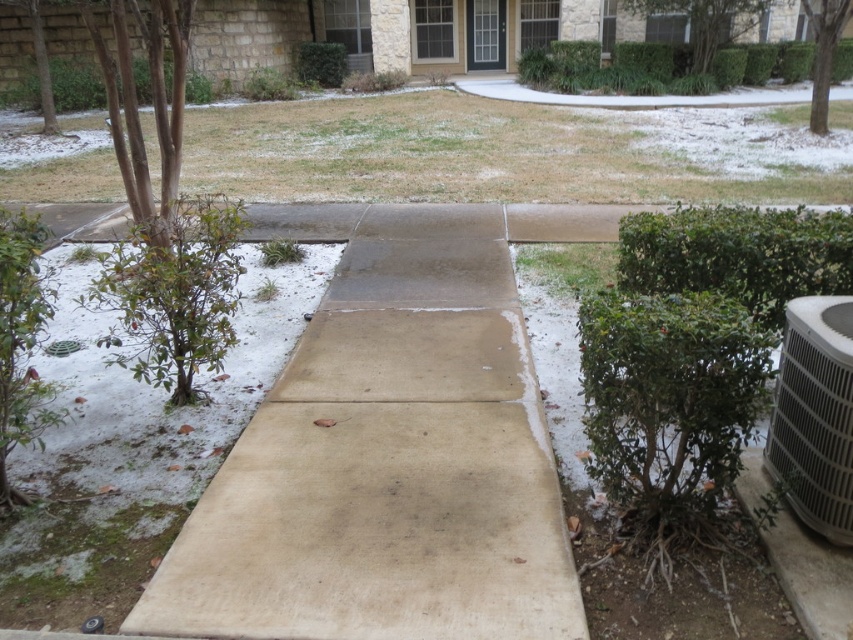
Does gray metallic air conditioner at lower right have a larger size compared to green leafy hedge at upper left?

Correct, gray metallic air conditioner at lower right is larger in size than green leafy hedge at upper left.

Is gray metallic air conditioner at lower right in front of green leafy hedge at upper left?

Yes.

Where is `gray metallic air conditioner at lower right`? This screenshot has width=853, height=640. gray metallic air conditioner at lower right is located at coordinates (815, 413).

You are a GUI agent. You are given a task and a screenshot of the screen. Output one action in this format:
    pyautogui.click(x=<x>, y=<y>)
    Task: Click on the gray metallic air conditioner at lower right
    The image size is (853, 640).
    Given the screenshot: What is the action you would take?
    (x=815, y=413)

Does green leafy bush at right have a smaller size compared to green leafy hedge at upper left?

Actually, green leafy bush at right might be larger than green leafy hedge at upper left.

Is point (738, 228) positioned behind point (99, 68)?

No.

The image size is (853, 640). I want to click on green leafy bush at right, so click(737, 253).

Can you confirm if green leafy bush at right is shorter than green leafy hedge at center?

Yes.

Is point (635, 284) positioned in front of point (312, 64)?

Yes, point (635, 284) is in front of point (312, 64).

The height and width of the screenshot is (640, 853). I want to click on green leafy bush at right, so click(x=737, y=253).